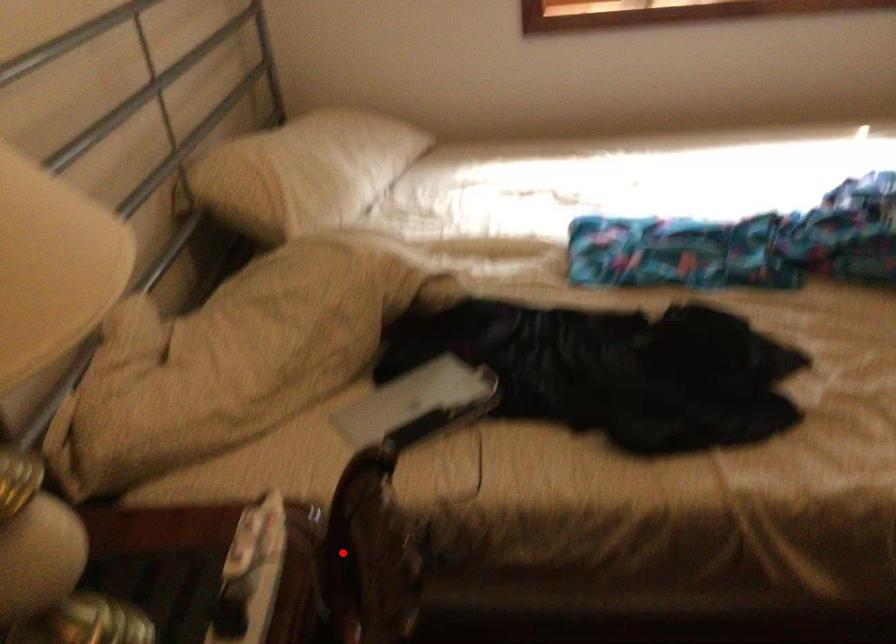
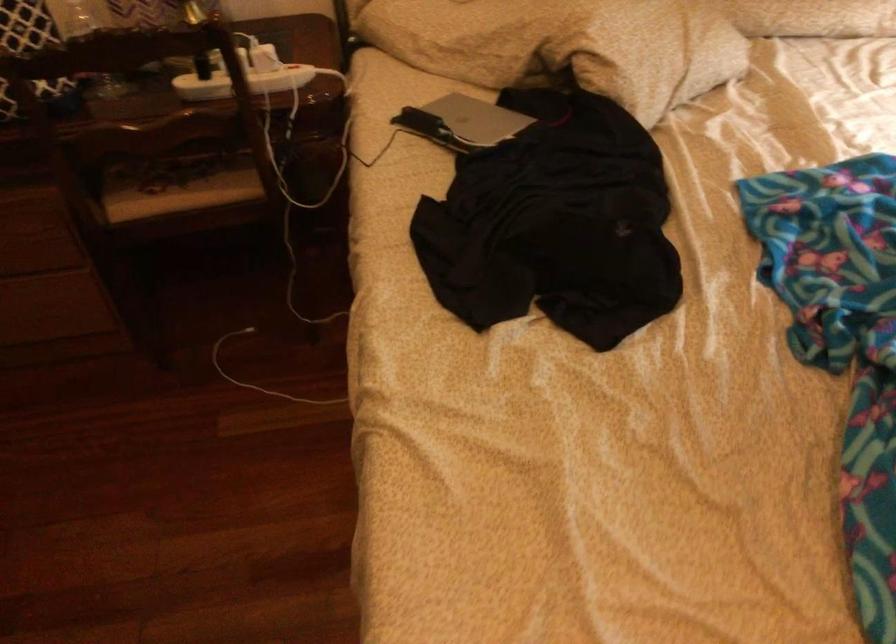
Question: I am providing you with two images of the same scene from different viewpoints. A red point is marked on the first image. Is the red point's position out of view in image 2?

Choices:
 (A) Yes
 (B) No

Answer: (B)